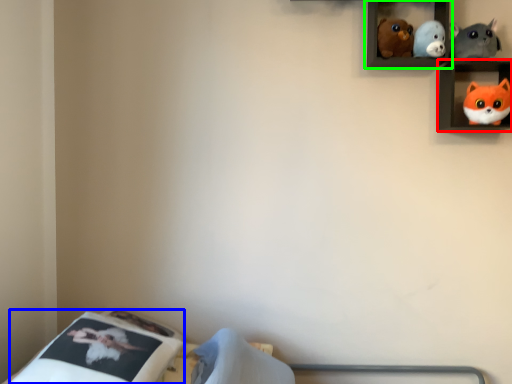
Question: Which object is the farthest from shelf (highlighted by a red box)? Choose among these: mattress (highlighted by a blue box) or shelf (highlighted by a green box).

Choices:
 (A) mattress
 (B) shelf

Answer: (A)